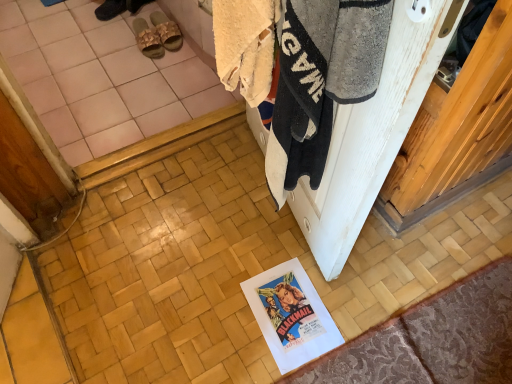
I want to click on unoccupied space behind white paper at lower center, so click(x=267, y=246).